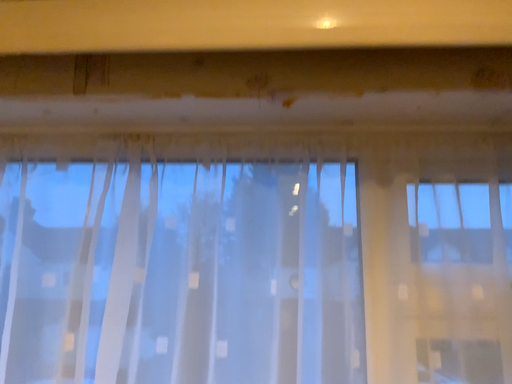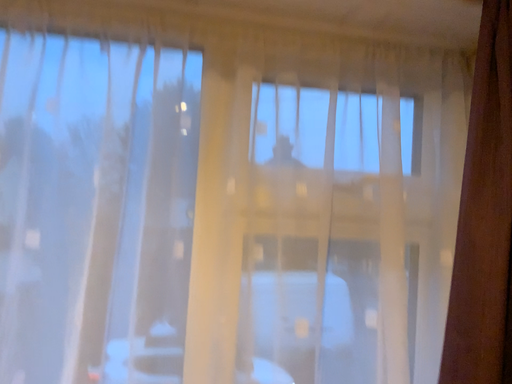
Question: Which way did the camera rotate in the video?

Choices:
 (A) rotated right
 (B) rotated left

Answer: (A)